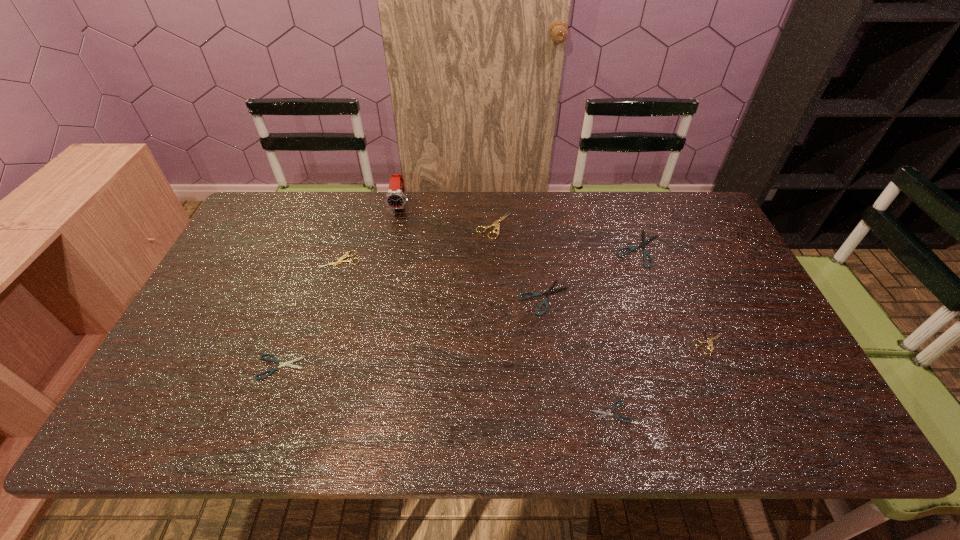
Where is `the sixth object from right to left`? The width and height of the screenshot is (960, 540). the sixth object from right to left is located at coordinates (395, 198).

This screenshot has width=960, height=540. I want to click on the tallest object, so click(x=395, y=198).

At what (x,y) coordinates should I click in order to perform the action: click on the third shears from left to right. Please return your answer as a coordinate pair (x, y). The image size is (960, 540). Looking at the image, I should click on (496, 223).

The width and height of the screenshot is (960, 540). In order to click on the second tallest object in this screenshot , I will do `click(496, 223)`.

This screenshot has height=540, width=960. Find the location of `the rightmost black shears`. the rightmost black shears is located at coordinates (645, 253).

Image resolution: width=960 pixels, height=540 pixels. What are the coordinates of `the biggest black shears` in the screenshot? It's located at click(x=645, y=253).

Locate an element on the screen. The height and width of the screenshot is (540, 960). the second farthest beige shears is located at coordinates (343, 257).

Locate an element on the screen. Image resolution: width=960 pixels, height=540 pixels. the second biggest beige shears is located at coordinates (343, 257).

Locate an element on the screen. This screenshot has width=960, height=540. the fourth nearest shears is located at coordinates (550, 291).

The width and height of the screenshot is (960, 540). Identify the location of the third nearest black shears. (550, 291).